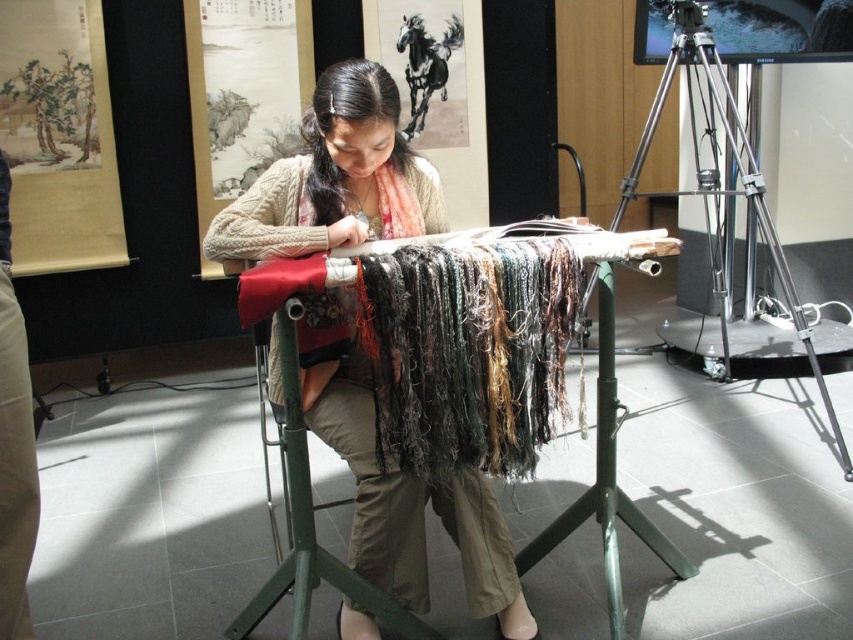
Does metallic green table at center come in front of metallic tripod at right?

Yes, metallic green table at center is closer to the viewer.

Is metallic green table at center positioned behind metallic tripod at right?

No, metallic green table at center is closer to the viewer.

This screenshot has width=853, height=640. Identify the location of metallic green table at center. (306, 522).

Identify the location of metallic green table at center. The height and width of the screenshot is (640, 853). (306, 522).